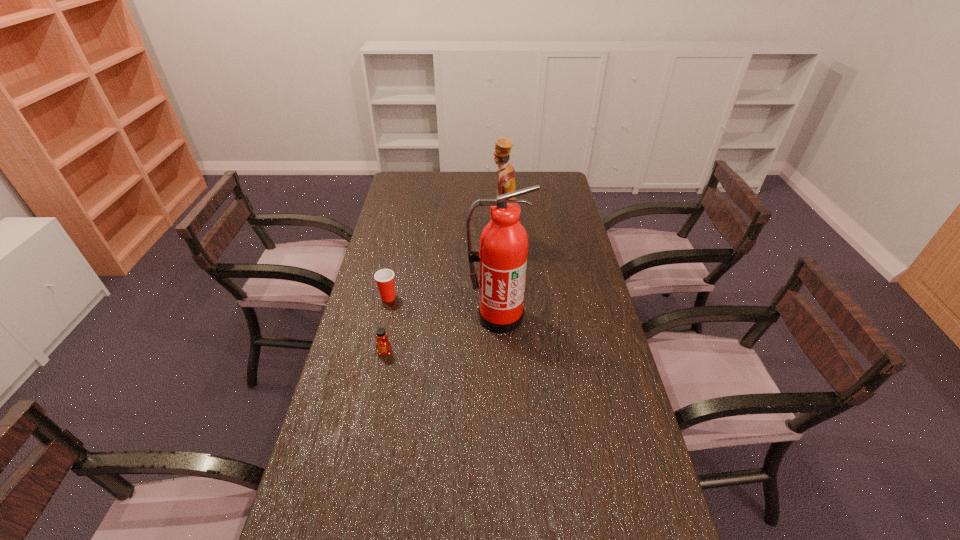
Where is `vacant region between the nearest object and the Dixie cup`? Image resolution: width=960 pixels, height=540 pixels. vacant region between the nearest object and the Dixie cup is located at coordinates (387, 325).

The width and height of the screenshot is (960, 540). Find the location of `blank region between the Dixie cup and the nearest object`. blank region between the Dixie cup and the nearest object is located at coordinates (387, 325).

Find the location of `empty space that is in between the Dixie cup and the nearest object`. empty space that is in between the Dixie cup and the nearest object is located at coordinates [x=387, y=325].

The height and width of the screenshot is (540, 960). In order to click on empty space that is in between the Dixie cup and the fire extinguisher in this screenshot , I will do `click(444, 307)`.

Where is `unoccupied area between the nutcracker and the Dixie cup`? This screenshot has width=960, height=540. unoccupied area between the nutcracker and the Dixie cup is located at coordinates (446, 273).

In order to click on object that stands as the second closest to the fire extinguisher in this screenshot , I will do (383, 346).

You are a GUI agent. You are given a task and a screenshot of the screen. Output one action in this format:
    pyautogui.click(x=<x>, y=<y>)
    Task: Click on the object identified as the closest to the fire extinguisher
    This screenshot has height=540, width=960.
    Given the screenshot: What is the action you would take?
    pyautogui.click(x=506, y=174)